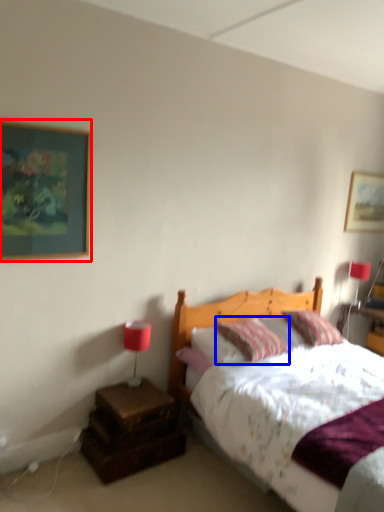
Question: Among these objects, which one is nearest to the camera, picture frame (highlighted by a red box) or pillow (highlighted by a blue box)?

Choices:
 (A) picture frame
 (B) pillow

Answer: (A)